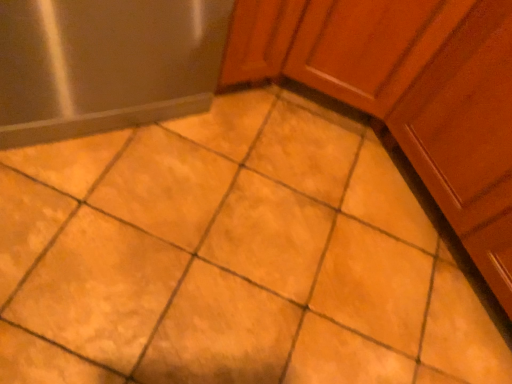
Question: From the image's perspective, relative to matte wood cabinet at upper right, is satin silver refrigerator at left above or below?

Choices:
 (A) below
 (B) above

Answer: (B)

Question: Is point (173, 74) positioned closer to the camera than point (446, 21)?

Choices:
 (A) farther
 (B) closer

Answer: (A)

Question: From a real-world perspective, is satin silver refrigerator at left above or below matte wood cabinet at upper right?

Choices:
 (A) above
 (B) below

Answer: (B)

Question: Considering the relative positions of matte wood cabinet at upper right and satin silver refrigerator at left in the image provided, is matte wood cabinet at upper right to the left or to the right of satin silver refrigerator at left?

Choices:
 (A) left
 (B) right

Answer: (B)

Question: From the image's perspective, relative to satin silver refrigerator at left, is matte wood cabinet at upper right above or below?

Choices:
 (A) below
 (B) above

Answer: (A)

Question: Would you say matte wood cabinet at upper right is inside or outside satin silver refrigerator at left?

Choices:
 (A) inside
 (B) outside

Answer: (B)

Question: Considering the positions of matte wood cabinet at upper right and satin silver refrigerator at left in the image, is matte wood cabinet at upper right taller or shorter than satin silver refrigerator at left?

Choices:
 (A) tall
 (B) short

Answer: (A)